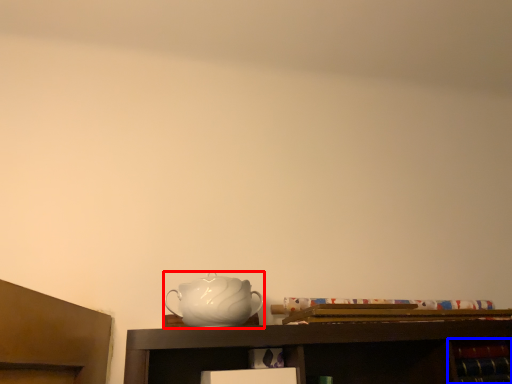
Question: Which point is closer to the camera, jug (highlighted by a red box) or cabinet (highlighted by a blue box)?

Choices:
 (A) jug
 (B) cabinet

Answer: (A)